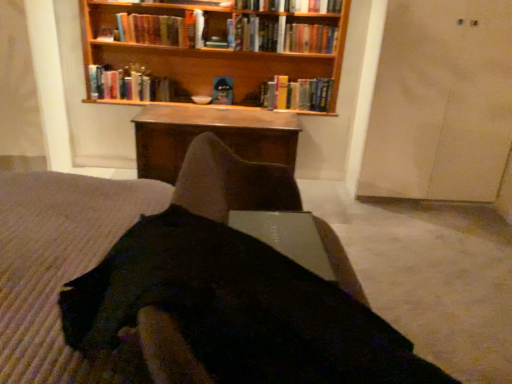
Question: Which direction should I rotate to look at hardcover book at center, the 6th book positioned from the left?

Choices:
 (A) left
 (B) right

Answer: (B)

Question: Is the position of metallic silver laptop at center more distant than that of wooden table at center?

Choices:
 (A) yes
 (B) no

Answer: (B)

Question: Is metallic silver laptop at center wider than wooden table at center?

Choices:
 (A) yes
 (B) no

Answer: (B)

Question: Can you confirm if metallic silver laptop at center is smaller than wooden table at center?

Choices:
 (A) yes
 (B) no

Answer: (A)

Question: Could you tell me if metallic silver laptop at center is facing wooden table at center?

Choices:
 (A) yes
 (B) no

Answer: (B)

Question: From a real-world perspective, is metallic silver laptop at center located higher than wooden table at center?

Choices:
 (A) no
 (B) yes

Answer: (B)

Question: From the image's perspective, is metallic silver laptop at center below wooden table at center?

Choices:
 (A) no
 (B) yes

Answer: (B)

Question: From a real-world perspective, does hardcover book at center, the 4th book when ordered from right to left, sit lower than hardcover book at upper center, which is the 3th book in right-to-left order?

Choices:
 (A) no
 (B) yes

Answer: (B)

Question: Is hardcover book at center, the 4th book when ordered from right to left, oriented away from hardcover book at upper center, which is the 3th book in right-to-left order?

Choices:
 (A) no
 (B) yes

Answer: (A)

Question: Is the depth of hardcover book at center, the 4th book when ordered from right to left, less than that of hardcover book at upper center, which is the 4th book from left to right?

Choices:
 (A) no
 (B) yes

Answer: (A)

Question: Is hardcover book at center, acting as the third book starting from the left, outside hardcover book at upper center, which is the 3th book in right-to-left order?

Choices:
 (A) no
 (B) yes

Answer: (B)

Question: Is hardcover book at upper center, which is the 3th book in right-to-left order, located within hardcover book at center, the 4th book when ordered from right to left?

Choices:
 (A) yes
 (B) no

Answer: (B)

Question: Can you confirm if hardcover book at center, the 4th book when ordered from right to left, is taller than hardcover book at upper center, which is the 4th book from left to right?

Choices:
 (A) yes
 (B) no

Answer: (A)

Question: Would you say hardcover book at upper center, the 2th book from the right, contains hardcover book at center, the 4th book when ordered from right to left?

Choices:
 (A) no
 (B) yes

Answer: (A)